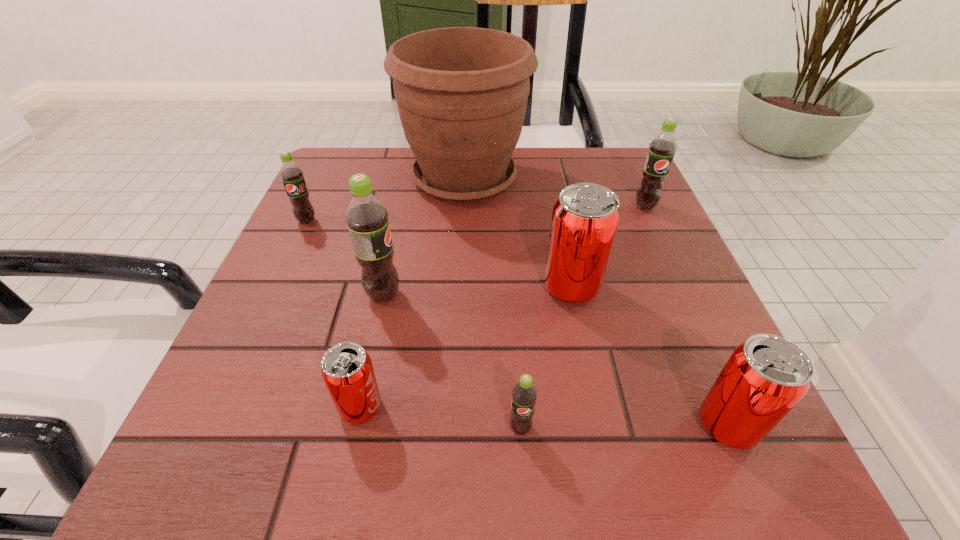
Image resolution: width=960 pixels, height=540 pixels. Find the location of `flowerpot that is at the far edge`. flowerpot that is at the far edge is located at coordinates (461, 92).

Where is `soda at the far edge`? soda at the far edge is located at coordinates (662, 148).

Where is `object located in the left edge section of the desktop`? This screenshot has width=960, height=540. object located in the left edge section of the desktop is located at coordinates (291, 174).

Identify the location of object present at the far right corner. (662, 148).

You are a GUI agent. You are given a task and a screenshot of the screen. Output one action in this format:
    pyautogui.click(x=<x>, y=<y>)
    Task: Click on the object present at the near right corner
    Image resolution: width=960 pixels, height=540 pixels.
    Given the screenshot: What is the action you would take?
    pyautogui.click(x=765, y=377)

Find the location of a particular element. vacant space at the far edge of the desktop is located at coordinates (559, 188).

This screenshot has width=960, height=540. What are the coordinates of `vacant space at the left edge of the desktop` in the screenshot? It's located at (321, 212).

The height and width of the screenshot is (540, 960). In order to click on free point at the right edge in this screenshot , I will do `click(641, 281)`.

In the image, there is a desktop. What are the coordinates of `free space at the far left corner` in the screenshot? It's located at (365, 166).

What are the coordinates of `free space between the rightmost red soda can and the leftmost green soda` in the screenshot? It's located at (517, 323).